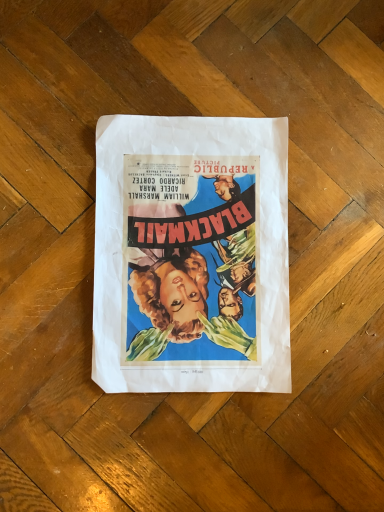
Describe the element at coordinates (191, 255) in the screenshot. The height and width of the screenshot is (512, 384). I see `matte paper poster at center` at that location.

The height and width of the screenshot is (512, 384). In order to click on matte paper poster at center in this screenshot , I will do `click(191, 255)`.

Looking at this image, in order to face matte paper poster at center, should I rotate leftwards or rightwards?

Turn right by 1.946 degrees to look at matte paper poster at center.

This screenshot has height=512, width=384. Identify the location of matte paper poster at center. (191, 255).